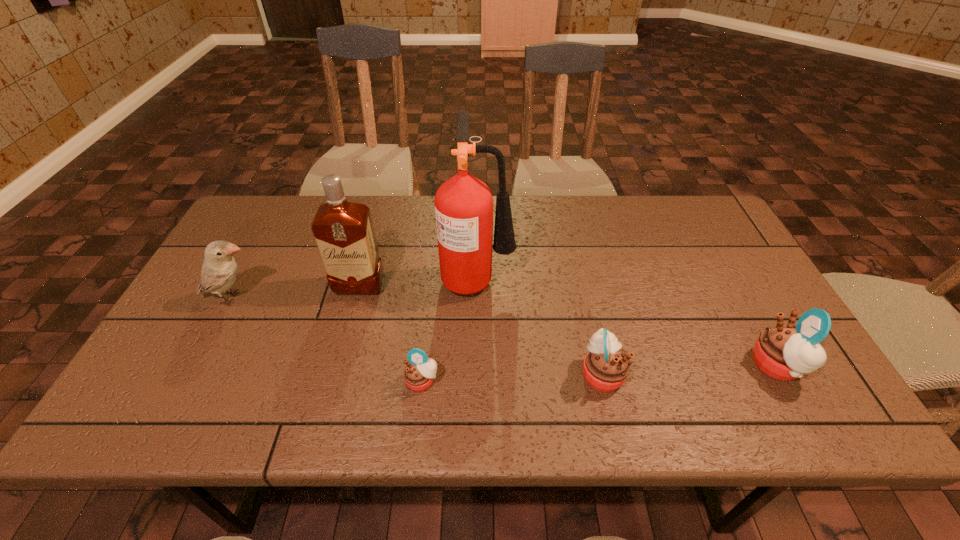
Where is `vacant space that is in between the fire extinguisher and the shortest muffin`? This screenshot has height=540, width=960. vacant space that is in between the fire extinguisher and the shortest muffin is located at coordinates (450, 329).

Locate an element on the screen. The image size is (960, 540). vacant area that lies between the rightmost object and the bird is located at coordinates (505, 332).

You are a GUI agent. You are given a task and a screenshot of the screen. Output one action in this format:
    pyautogui.click(x=<x>, y=<y>)
    Task: Click on the free point between the liquor and the bird
    
    Given the screenshot: What is the action you would take?
    [297, 292]

At what (x,y) coordinates should I click in order to perform the action: click on vacant region between the second shortest muffin and the bird. Please return your answer as a coordinate pair (x, y). Looking at the image, I should click on (418, 336).

Where is `object identified as the closest to the shortest muffin`? Image resolution: width=960 pixels, height=540 pixels. object identified as the closest to the shortest muffin is located at coordinates (463, 204).

Find the location of a particular element. This screenshot has width=960, height=540. the fifth closest object to the shortest object is located at coordinates (785, 352).

This screenshot has width=960, height=540. Identify the location of the second closest muffin to the shortest muffin. (785, 352).

Identify which muffin is the nearest to the tallest object. Please provide its 2D coordinates. Your answer should be formatted as a tuple, i.e. [(x, y)], where the tuple contains the x and y coordinates of a point satisfying the conditions above.

[(419, 373)]

What are the coordinates of `vacant point that satisfies the following two spatial constraints: 1. on the front label of the liquor; 2. at the face of the bird` in the screenshot? It's located at (356, 298).

Locate an element on the screen. vacant region that satisfies the following two spatial constraints: 1. at the nozzle of the tallest object; 2. on the front-facing side of the shortest muffin is located at coordinates (477, 381).